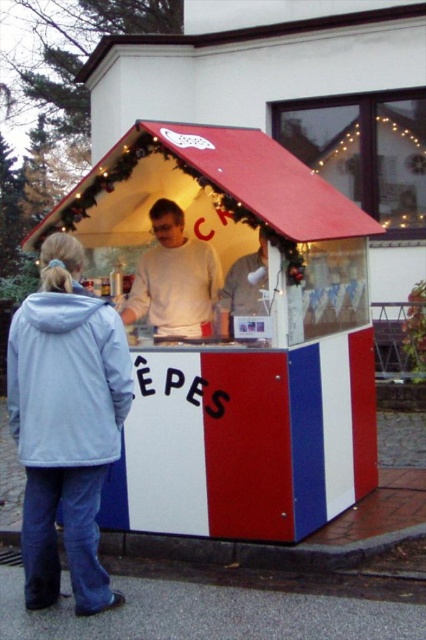
Question: Based on their relative distances, which object is farther from the white matte sweater at center?

Choices:
 (A) white plastic stall at center
 (B) light blue fabric jacket at lower left

Answer: (B)

Question: Which of these objects is positioned closest to the light blue fabric jacket at lower left?

Choices:
 (A) white matte sweater at center
 (B) white plastic stall at center

Answer: (B)

Question: Is light blue fabric jacket at lower left behind white matte sweater at center?

Choices:
 (A) yes
 (B) no

Answer: (B)

Question: Can you confirm if white plastic stall at center is positioned to the right of light blue fabric jacket at lower left?

Choices:
 (A) no
 (B) yes

Answer: (B)

Question: Is white plastic stall at center behind light blue fabric jacket at lower left?

Choices:
 (A) yes
 (B) no

Answer: (A)

Question: Which of the following is the farthest from the observer?

Choices:
 (A) (13, 321)
 (B) (273, 266)

Answer: (A)